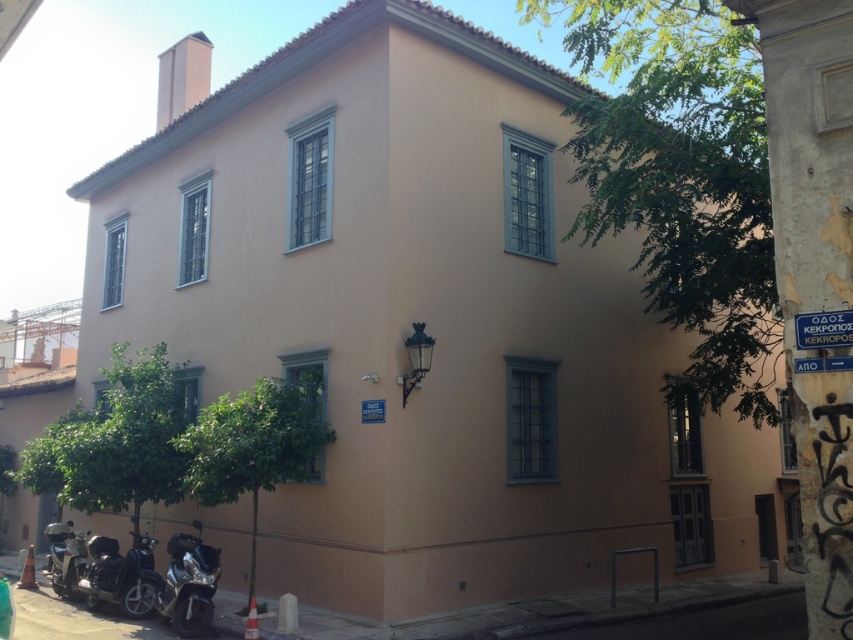
You are standing at the entrance of the two story building and want to move to the shiny chrome motorcycle at lower left. How many steps would you need to take to reach it?

The shiny chrome motorcycle at lower left is 34.31 feet away from the camera. Assuming an average step length of 2.5 feet, you would need approximately 14 steps to reach it.

You are a delivery person who needs to park your vehicle in front of the two motorcycles. The shiny chrome motorcycle at lower left and the shiny silver motorcycle at lower left are both parked there. Which motorcycle takes up more space because of its size?

The shiny chrome motorcycle at lower left takes up more space because it has a larger size compared to the shiny silver motorcycle at lower left.